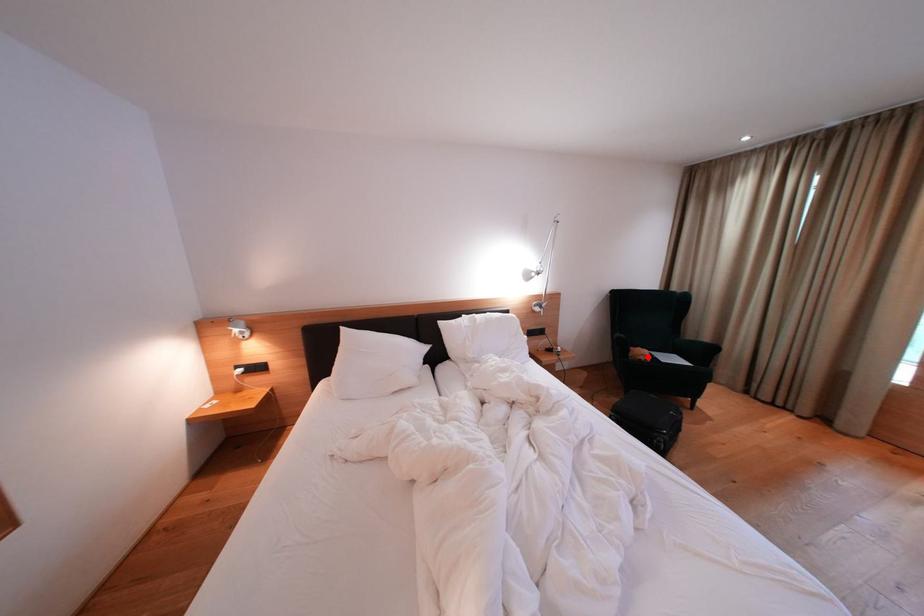
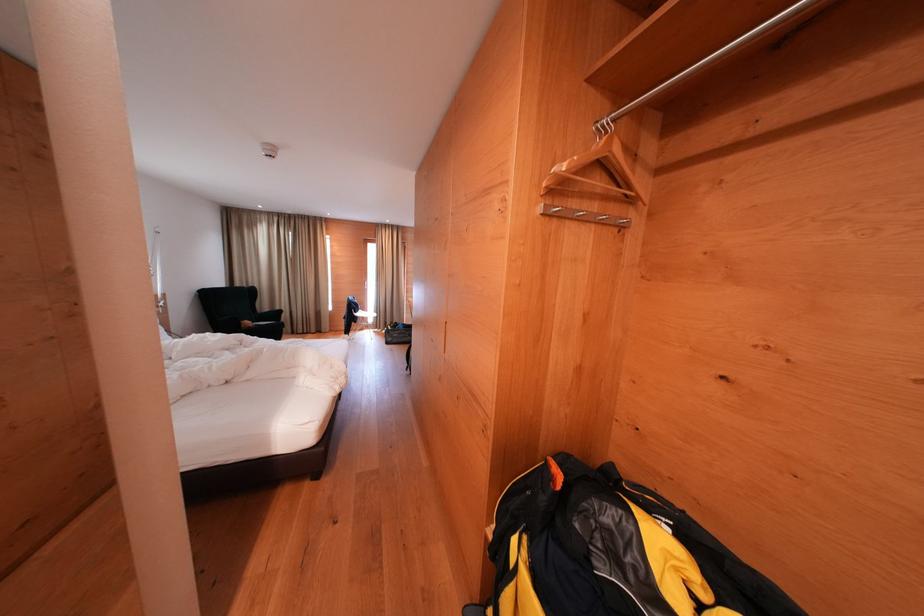
Find the pixel in the second image that matches the highlighted location in the first image.

(254, 328)